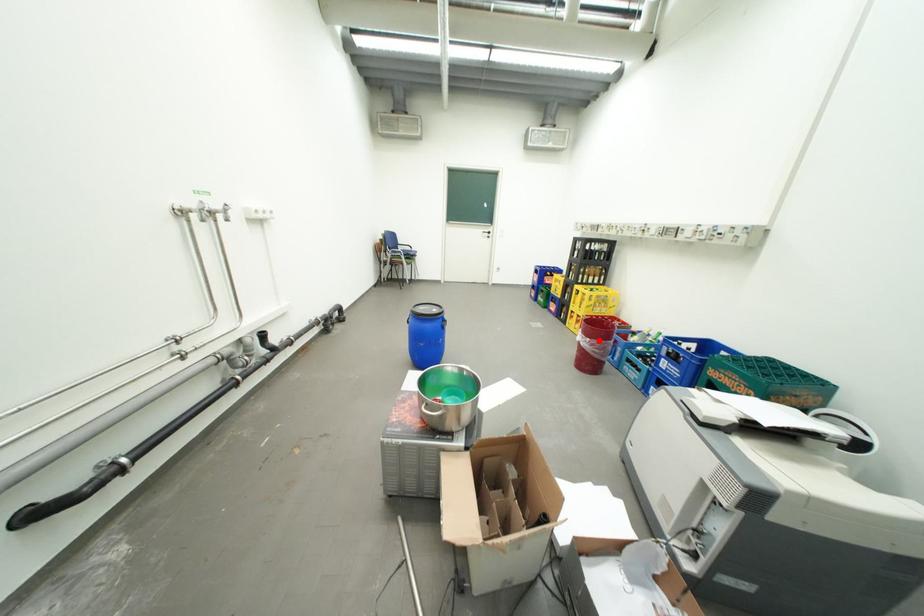
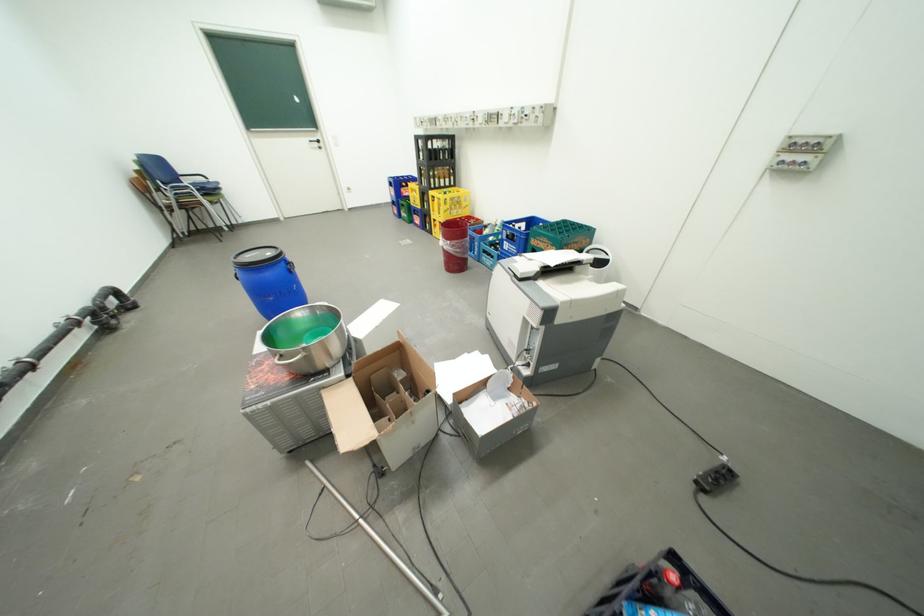
In the second image, find the point that corresponds to the highlighted location in the first image.

(459, 243)